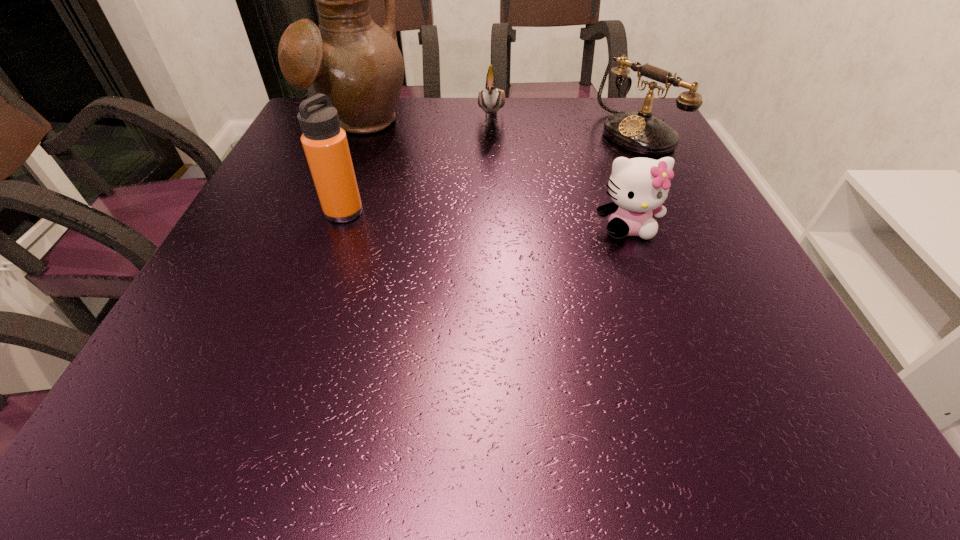
Find the location of a particular element. kitten located in the right edge section of the desktop is located at coordinates (638, 186).

At what (x,y) coordinates should I click in order to perform the action: click on telephone situated at the right edge. Please return your answer as a coordinate pair (x, y). Image resolution: width=960 pixels, height=540 pixels. Looking at the image, I should click on (640, 132).

At what (x,y) coordinates should I click in order to perform the action: click on object present at the far left corner. Please return your answer as a coordinate pair (x, y). Looking at the image, I should click on (349, 58).

You are a GUI agent. You are given a task and a screenshot of the screen. Output one action in this format:
    pyautogui.click(x=<x>, y=<y>)
    Task: Click on the object situated at the far right corner
    
    Given the screenshot: What is the action you would take?
    640,132

Where is `vacant space at the near edge of the desktop`? Image resolution: width=960 pixels, height=540 pixels. vacant space at the near edge of the desktop is located at coordinates (677, 354).

Where is `vacant space at the left edge`? This screenshot has height=540, width=960. vacant space at the left edge is located at coordinates (349, 143).

In the image, there is a desktop. In order to click on vacant space at the right edge in this screenshot , I will do pos(684,294).

In the image, there is a desktop. At what (x,y) coordinates should I click in order to perform the action: click on vacant space at the far left corner. Please return your answer as a coordinate pair (x, y). The height and width of the screenshot is (540, 960). Looking at the image, I should click on (291, 134).

Find the location of a particular element. This screenshot has width=960, height=540. free space between the kitten and the tallest object is located at coordinates (493, 177).

Locate an element on the screen. free space between the second tallest object and the kitten is located at coordinates (486, 220).